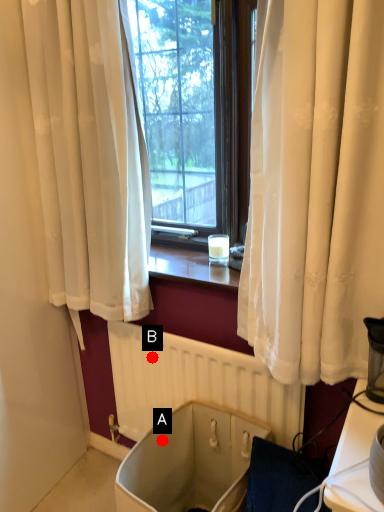
Question: Two points are circled on the image, labeled by A and B beside each circle. Which point is closer to the camera?

Choices:
 (A) A is closer
 (B) B is closer

Answer: (A)